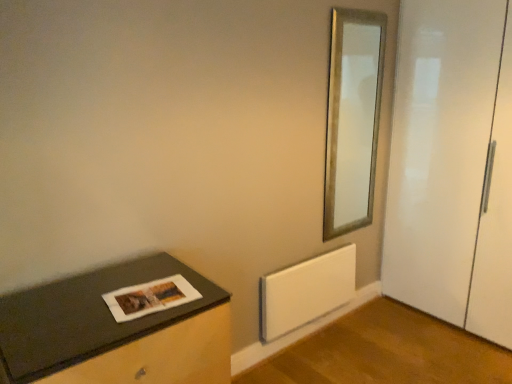
Question: In the image, is dark gray matte table at lower left on the left side or the right side of gold metallic mirror at upper right?

Choices:
 (A) left
 (B) right

Answer: (A)

Question: Looking at their shapes, would you say dark gray matte table at lower left is wider or thinner than gold metallic mirror at upper right?

Choices:
 (A) thin
 (B) wide

Answer: (B)

Question: Based on their relative distances, which object is farther from the dark gray matte table at lower left?

Choices:
 (A) white glossy door at right
 (B) matte paper magazine at lower left
 (C) gold metallic mirror at upper right
 (D) white matte radiator at lower center

Answer: (A)

Question: Which is nearer to the white glossy door at right?

Choices:
 (A) white matte radiator at lower center
 (B) matte paper magazine at lower left
 (C) gold metallic mirror at upper right
 (D) dark gray matte table at lower left

Answer: (C)